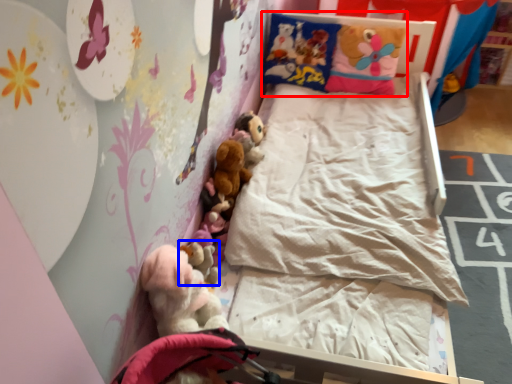
Question: Which of the following is the farthest to the observer, pillow (highlighted by a red box) or toy (highlighted by a blue box)?

Choices:
 (A) pillow
 (B) toy

Answer: (A)